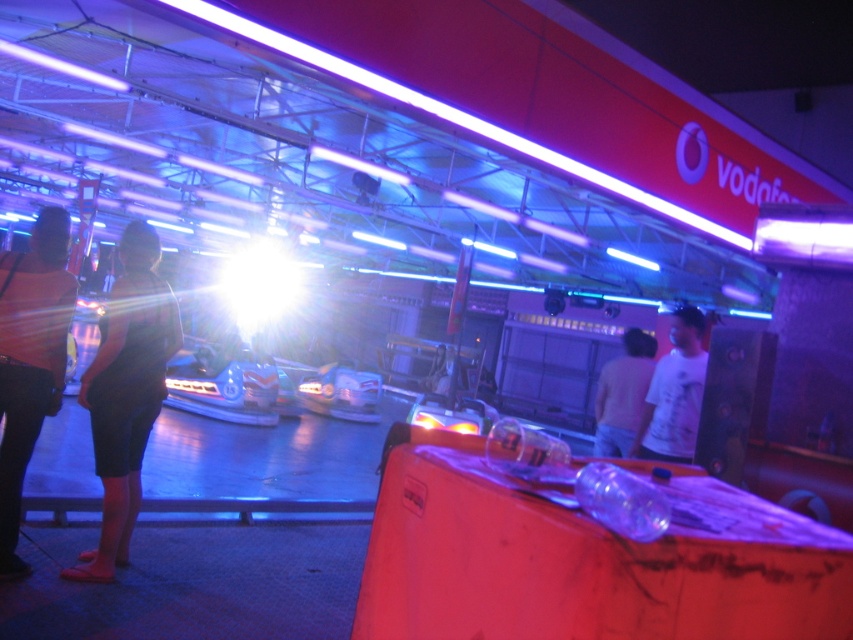
Question: Is light blue plastic bumper car at center to the left of light brown shirt at center from the viewer's perspective?

Choices:
 (A) yes
 (B) no

Answer: (A)

Question: Does light brown shirt at center come behind shiny plastic bumper car at center?

Choices:
 (A) no
 (B) yes

Answer: (A)

Question: Which point is farther to the camera?

Choices:
 (A) matte black dress at left
 (B) dark fabric shorts at left
 (C) white matte t-shirt at center
 (D) light blue plastic bumper car at center

Answer: (D)

Question: In this image, where is light brown shirt at center located relative to shiny plastic bumper car at center?

Choices:
 (A) right
 (B) left

Answer: (A)

Question: Considering the real-world distances, which object is farthest from the light brown shirt at center?

Choices:
 (A) white matte t-shirt at center
 (B) matte black dress at left
 (C) shiny plastic bumper car at center
 (D) dark fabric shorts at left

Answer: (C)

Question: Which point is closer to the camera taking this photo?

Choices:
 (A) (350, 388)
 (B) (596, 381)
 (C) (7, 257)

Answer: (C)